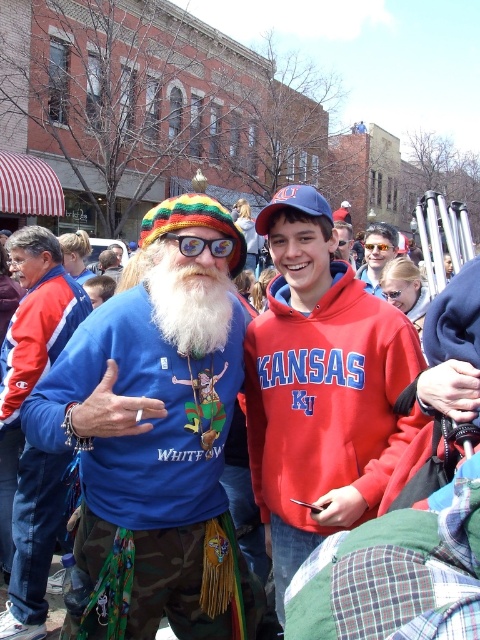
Question: Is camouflage pants at center thinner than whitewoolbeard at center?

Choices:
 (A) yes
 (B) no

Answer: (B)

Question: Which of these objects is positioned farthest from the multicolored plastic goggles at center?

Choices:
 (A) whitewoolbeard at center
 (B) red fleece hoodie at center

Answer: (B)

Question: Is blue cotton shirt at center wider than whitewoolbeard at center?

Choices:
 (A) no
 (B) yes

Answer: (B)

Question: Estimate the real-world distances between objects in this image. Which object is closer to the blue cotton shirt at center?

Choices:
 (A) matte sunglasses at center
 (B) matte red hoodie at center

Answer: (A)

Question: Does camouflage pants at center have a smaller size compared to matte red hoodie at center?

Choices:
 (A) no
 (B) yes

Answer: (B)

Question: Among these objects, which one is farthest from the camera?

Choices:
 (A) red fleece hoodie at center
 (B) multicolored plastic goggles at center

Answer: (B)